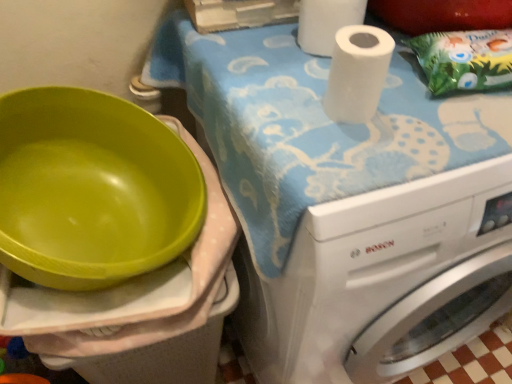
Question: Which direction should I rotate to look at white matte paper towel at upper center, the 2th paper towel in the back-to-front sequence, — up or down?

Choices:
 (A) up
 (B) down

Answer: (A)

Question: Is the depth of white matte paper towel at upper center, the first paper towel ordered from the bottom, greater than that of white matte paper towel at upper right, which is the 2th paper towel in bottom-to-top order?

Choices:
 (A) yes
 (B) no

Answer: (B)

Question: Does white matte paper towel at upper center, the first paper towel ordered from the bottom, come in front of white matte paper towel at upper right, the first paper towel in the top-to-bottom sequence?

Choices:
 (A) yes
 (B) no

Answer: (A)

Question: Can white matte paper towel at upper right, which appears as the 1th paper towel when viewed from the back, be found inside white matte paper towel at upper center, placed as the 1th paper towel when sorted from front to back?

Choices:
 (A) yes
 (B) no

Answer: (B)

Question: From a real-world perspective, is white matte paper towel at upper center, the 2th paper towel from the top, located beneath white matte paper towel at upper right, which appears as the 1th paper towel when viewed from the back?

Choices:
 (A) yes
 (B) no

Answer: (B)

Question: Can you confirm if white matte paper towel at upper center, placed as the 1th paper towel when sorted from front to back, is taller than white matte paper towel at upper right, which appears as the 1th paper towel when viewed from the back?

Choices:
 (A) yes
 (B) no

Answer: (B)

Question: Is white matte paper towel at upper center, the first paper towel ordered from the bottom, not within white matte paper towel at upper right, which is the 2th paper towel in bottom-to-top order?

Choices:
 (A) no
 (B) yes

Answer: (B)

Question: Considering the relative sizes of white glossy washing machine at upper right and white matte paper towel at upper center, the 2th paper towel in the back-to-front sequence, in the image provided, is white glossy washing machine at upper right thinner than white matte paper towel at upper center, the 2th paper towel in the back-to-front sequence,?

Choices:
 (A) no
 (B) yes

Answer: (A)

Question: Is white glossy washing machine at upper right positioned in front of white matte paper towel at upper center, placed as the 1th paper towel when sorted from front to back?

Choices:
 (A) no
 (B) yes

Answer: (B)

Question: From the image's perspective, is white glossy washing machine at upper right located beneath white matte paper towel at upper center, the 2th paper towel from the top?

Choices:
 (A) yes
 (B) no

Answer: (A)

Question: Does white glossy washing machine at upper right appear on the right side of white matte paper towel at upper center, placed as the 1th paper towel when sorted from front to back?

Choices:
 (A) yes
 (B) no

Answer: (A)

Question: Is the position of white glossy washing machine at upper right more distant than that of white matte paper towel at upper center, placed as the 1th paper towel when sorted from front to back?

Choices:
 (A) yes
 (B) no

Answer: (B)

Question: Is white glossy washing machine at upper right positioned beyond the bounds of white matte paper towel at upper center, placed as the 1th paper towel when sorted from front to back?

Choices:
 (A) yes
 (B) no

Answer: (A)

Question: Would you say green paper bag at upper right contains white matte paper towel at upper right, the first paper towel in the top-to-bottom sequence?

Choices:
 (A) yes
 (B) no

Answer: (B)